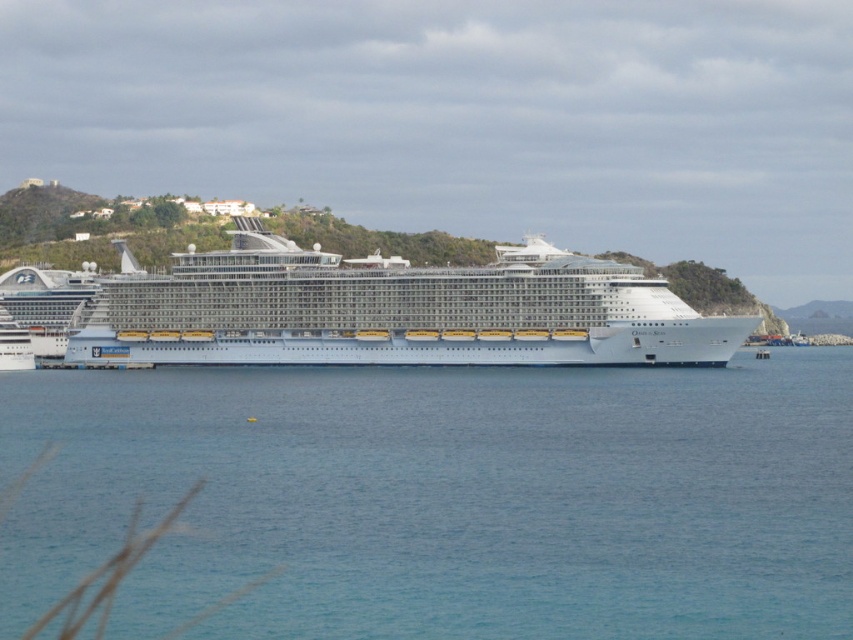
You are standing on the dock and looking at the blue water at center and the white metallic cruise ship at center. Which object is closer to you?

The blue water at center is closer to you because it is in front of the white metallic cruise ship at center.

You are standing on the cruise ship and want to locate the blue water at center. According to the coordinates given, where would you look relative to your position?

The blue water at center is located at coordinates 0.778 on the x axis and 0.523 on the y axis, so you should look towards the right side of the ship since the x coordinate is greater than 0.5.

You are standing on the dock and looking at the blue water at center and the white metallic cruise ship at center. Which object takes up more space in the image?

The white metallic cruise ship at center occupies more space in the image than the blue water at center, as stated in the description.